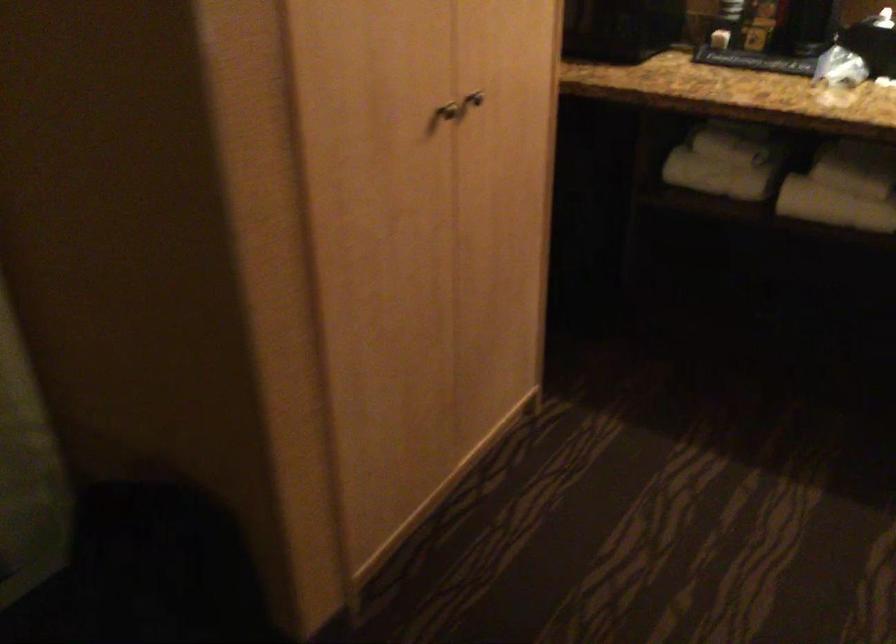
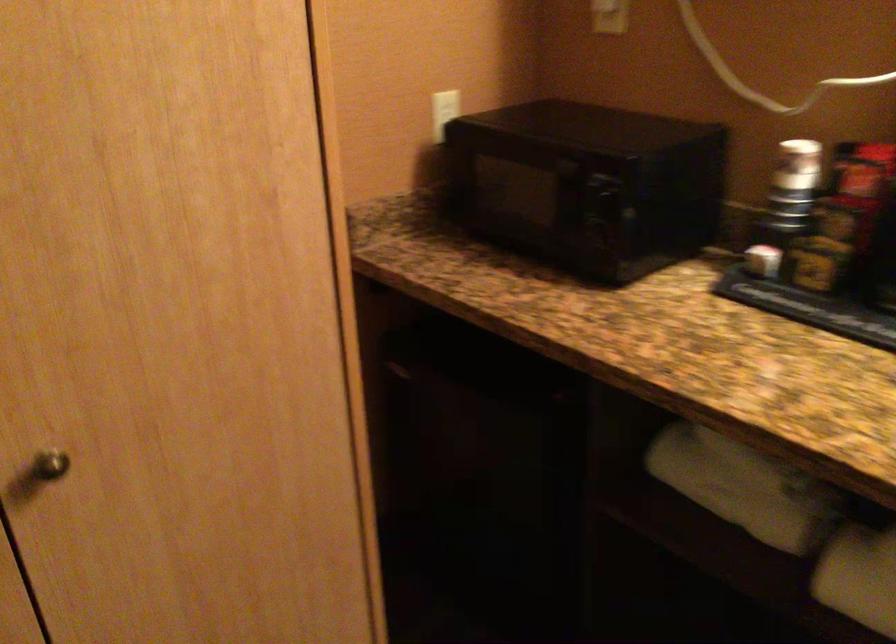
In a continuous first-person perspective shot, in which direction is the camera moving?

The movement direction of the cameraman is right, forward.